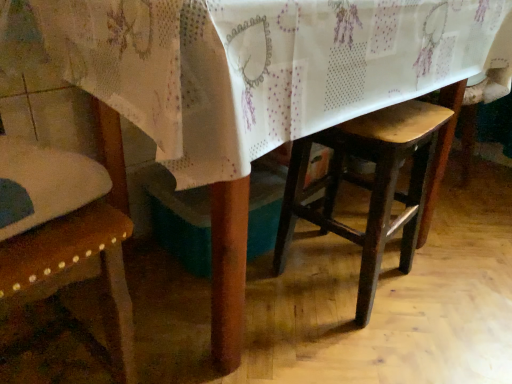
Image resolution: width=512 pixels, height=384 pixels. Identify the location of wooden chair at left. (87, 245).

This screenshot has width=512, height=384. What do you see at coordinates (87, 245) in the screenshot?
I see `wooden chair at left` at bounding box center [87, 245].

Image resolution: width=512 pixels, height=384 pixels. In order to click on wooden stool at center in this screenshot , I will do click(x=366, y=186).

The height and width of the screenshot is (384, 512). What do you see at coordinates (366, 186) in the screenshot?
I see `wooden stool at center` at bounding box center [366, 186].

Identify the location of wooden chair at left. This screenshot has width=512, height=384. (87, 245).

Considering the positions of objects wooden stool at center and wooden chair at left in the image provided, who is more to the right, wooden stool at center or wooden chair at left?

From the viewer's perspective, wooden stool at center appears more on the right side.

Is wooden stool at center in front of or behind wooden chair at left in the image?

wooden stool at center is behind wooden chair at left.

Which is closer to the camera, (343,152) or (125,231)?

The point (125,231) is more forward.

From the image's perspective, which one is positioned lower, wooden stool at center or wooden chair at left?

From the image's view, wooden chair at left is below.

From a real-world perspective, relative to wooden chair at left, is wooden stool at center vertically above or below?

wooden stool at center is below wooden chair at left.

Can you confirm if wooden stool at center is thinner than wooden chair at left?

Indeed, wooden stool at center has a lesser width compared to wooden chair at left.

Is wooden stool at center taller than wooden chair at left?

No.

Considering the relative sizes of wooden stool at center and wooden chair at left in the image provided, is wooden stool at center bigger than wooden chair at left?

No, wooden stool at center is not bigger than wooden chair at left.

Is wooden chair at left surrounded by wooden stool at center?

No, wooden chair at left is not surrounded by wooden stool at center.

Is there a large distance between wooden stool at center and wooden chair at left?

No, wooden stool at center is in close proximity to wooden chair at left.

Is wooden stool at center aimed at wooden chair at left?

No, wooden stool at center does not turn towards wooden chair at left.

How many degrees apart are the facing directions of wooden stool at center and wooden chair at left?

The angle between the facing direction of wooden stool at center and the facing direction of wooden chair at left is 174 degrees.

The width and height of the screenshot is (512, 384). Identify the location of stool below the wooden chair at left (from a real-world perspective). (366, 186).

From the picture: Which is more to the right, wooden chair at left or wooden stool at center?

Positioned to the right is wooden stool at center.

Is wooden chair at left positioned before wooden stool at center?

Yes, wooden chair at left is closer to the viewer.

Is point (83, 247) closer to viewer compared to point (365, 255)?

That is True.

From the image's perspective, is wooden chair at left positioned above or below wooden stool at center?

wooden chair at left is situated lower than wooden stool at center in the image.

Looking at this image, from a real-world perspective, which object stands above the other?

From a 3D spatial view, wooden chair at left is above.

Based on the photo, between wooden chair at left and wooden stool at center, which one has larger width?

wooden chair at left is wider.

Which of these two, wooden chair at left or wooden stool at center, stands taller?

Standing taller between the two is wooden chair at left.

Which of these two, wooden chair at left or wooden stool at center, is bigger?

wooden chair at left is bigger.

Is wooden chair at left inside the boundaries of wooden stool at center, or outside?

wooden chair at left lies outside wooden stool at center.

Is wooden chair at left beside wooden stool at center?

No, wooden chair at left is not beside wooden stool at center.

Is wooden chair at left turned away from wooden stool at center?

No, wooden stool at center is not at the back of wooden chair at left.

How distant is wooden chair at left from wooden stool at center?

wooden chair at left is 23.63 inches from wooden stool at center.

Locate an element on the screen. stool below the wooden chair at left (from a real-world perspective) is located at coordinates (366, 186).

Where is `stool behind the wooden chair at left`? stool behind the wooden chair at left is located at coordinates (366, 186).

At what (x,y) coordinates should I click in order to perform the action: click on chair in front of the wooden stool at center. Please return your answer as a coordinate pair (x, y). Looking at the image, I should click on (87, 245).